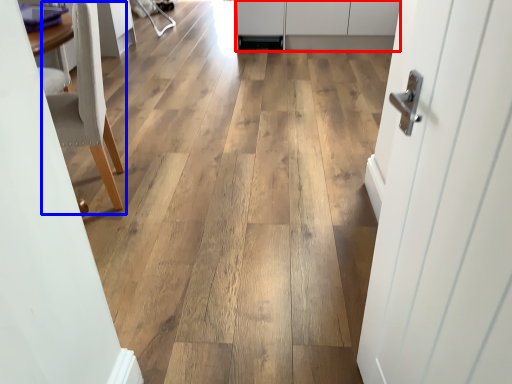
Question: Among these objects, which one is farthest to the camera, cabinetry (highlighted by a red box) or chair (highlighted by a blue box)?

Choices:
 (A) cabinetry
 (B) chair

Answer: (A)